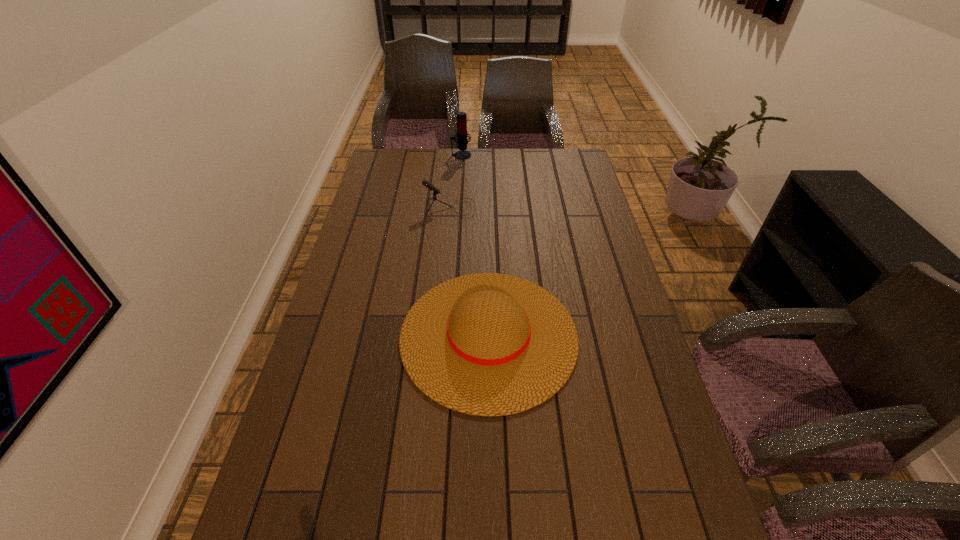
Find the location of a particular element. Image resolution: width=960 pixels, height=540 pixels. the farther microphone is located at coordinates (462, 134).

Locate an element on the screen. This screenshot has width=960, height=540. the taller microphone is located at coordinates (462, 134).

Where is `bonnet`? This screenshot has width=960, height=540. bonnet is located at coordinates (487, 344).

Locate an element on the screen. the shorter microphone is located at coordinates (430, 186).

The width and height of the screenshot is (960, 540). Identify the location of the nearer microphone. (430, 186).

Where is `free space located on the front of the farthest object`? This screenshot has height=540, width=960. free space located on the front of the farthest object is located at coordinates (458, 202).

Image resolution: width=960 pixels, height=540 pixels. I want to click on blank space located 0.100m on the front of the nearest object, so click(491, 458).

Where is `free space located 0.310m on the stand of the nearer microphone`? This screenshot has height=540, width=960. free space located 0.310m on the stand of the nearer microphone is located at coordinates (558, 208).

Find the location of a particular element. Image resolution: width=960 pixels, height=540 pixels. object situated at the far edge is located at coordinates (462, 134).

This screenshot has width=960, height=540. In the image, there is a desktop. What are the coordinates of `vacant space at the far edge` in the screenshot? It's located at 417,172.